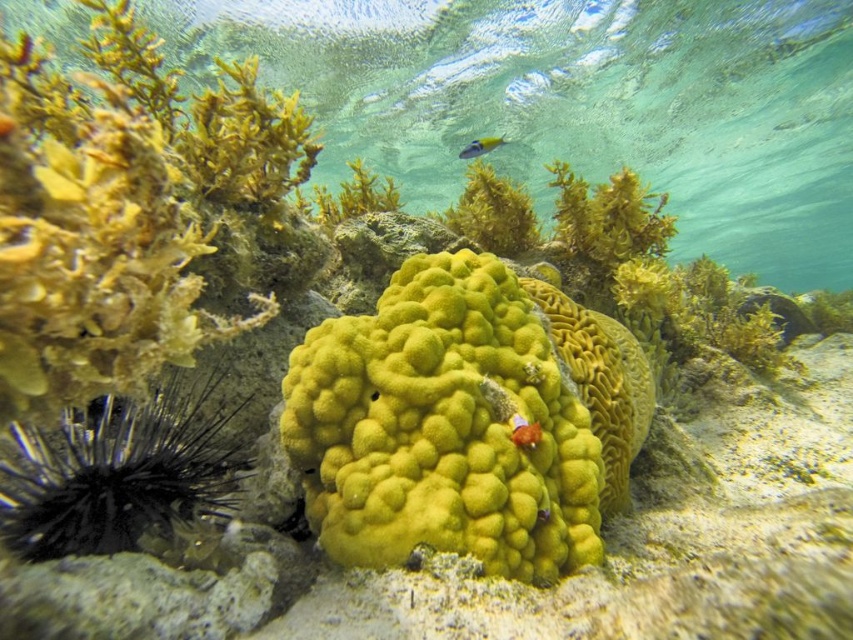
What is located at the coordinates point (347, 196)?

The coordinates point (347, 196) are occupied by green matte algae at center.